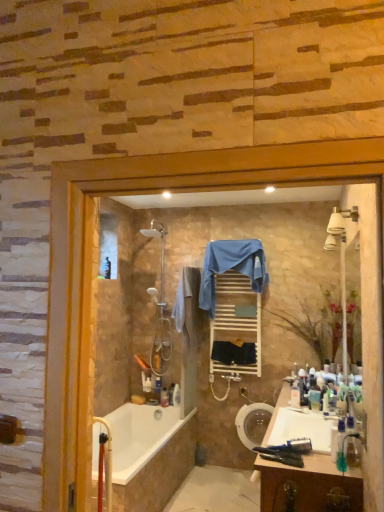
Question: From a real-world perspective, is white wooden towel rack at center located beneath translucent plastic toothbrush at lower right, the third toiletry when ordered from back to front?

Choices:
 (A) no
 (B) yes

Answer: (A)

Question: Is white wooden towel rack at center taller than translucent plastic toothbrush at lower right, which is the second toiletry from right to left?

Choices:
 (A) no
 (B) yes

Answer: (B)

Question: From a real-world perspective, is white wooden towel rack at center physically above translucent plastic toothbrush at lower right, acting as the 2th toiletry starting from the front?

Choices:
 (A) yes
 (B) no

Answer: (A)

Question: Is translucent plastic toothbrush at lower right, which is the second toiletry from right to left, located within white wooden towel rack at center?

Choices:
 (A) no
 (B) yes

Answer: (A)

Question: Can you confirm if white wooden towel rack at center is positioned to the right of translucent plastic toothbrush at lower right, acting as the 2th toiletry starting from the front?

Choices:
 (A) yes
 (B) no

Answer: (B)

Question: In terms of width, does beige cotton bath towel at center, placed as the 1th bath towel when sorted from left to right, look wider or thinner when compared to white wooden towel rack at center?

Choices:
 (A) wide
 (B) thin

Answer: (A)

Question: From the image's perspective, is beige cotton bath towel at center, acting as the 3th bath towel starting from the right, located above or below white wooden towel rack at center?

Choices:
 (A) below
 (B) above

Answer: (B)

Question: From a real-world perspective, relative to white wooden towel rack at center, is beige cotton bath towel at center, placed as the 1th bath towel when sorted from left to right, vertically above or below?

Choices:
 (A) below
 (B) above

Answer: (B)

Question: Looking at the image, does beige cotton bath towel at center, acting as the 3th bath towel starting from the right, seem bigger or smaller compared to white wooden towel rack at center?

Choices:
 (A) small
 (B) big

Answer: (B)

Question: In the image, is polished chrome shower at center positioned in front of or behind beige cotton bath towel at center, placed as the 1th bath towel when sorted from left to right?

Choices:
 (A) behind
 (B) front

Answer: (A)

Question: In terms of width, does polished chrome shower at center look wider or thinner when compared to beige cotton bath towel at center, acting as the 3th bath towel starting from the right?

Choices:
 (A) thin
 (B) wide

Answer: (B)

Question: Is polished chrome shower at center taller or shorter than beige cotton bath towel at center, acting as the 3th bath towel starting from the right?

Choices:
 (A) tall
 (B) short

Answer: (A)

Question: Is polished chrome shower at center bigger or smaller than beige cotton bath towel at center, placed as the 1th bath towel when sorted from left to right?

Choices:
 (A) big
 (B) small

Answer: (A)

Question: From their relative heights in the image, would you say translucent plastic bottle at lower center, marked as the fourth toiletry in a top-to-bottom arrangement, is taller or shorter than white wooden towel rack at center?

Choices:
 (A) tall
 (B) short

Answer: (B)

Question: From the image's perspective, is translucent plastic bottle at lower center, the 1th toiletry viewed from the left, above or below white wooden towel rack at center?

Choices:
 (A) below
 (B) above

Answer: (A)